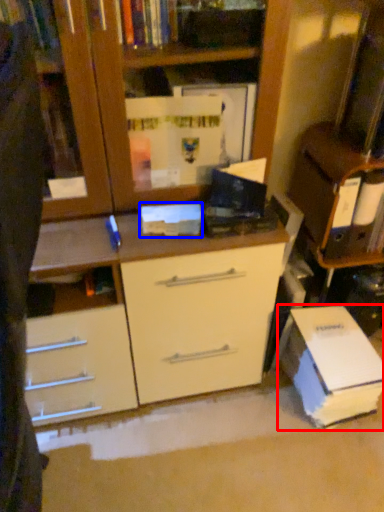
Question: Among these objects, which one is nearest to the camera, paperback book (highlighted by a red box) or paperback book (highlighted by a blue box)?

Choices:
 (A) paperback book
 (B) paperback book

Answer: (B)